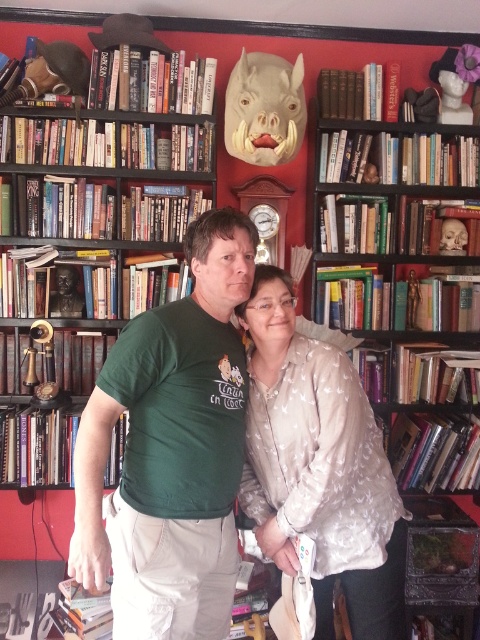
Does wooden bookshelf at left appear on the left side of hardcover books at right?

Yes, wooden bookshelf at left is to the left of hardcover books at right.

How distant is wooden bookshelf at left from hardcover books at right?

wooden bookshelf at left and hardcover books at right are 34.61 inches apart from each other.

Does point (120, 193) come farther from viewer compared to point (389, 406)?

No, (120, 193) is closer to viewer.

Identify the location of wooden bookshelf at left. The height and width of the screenshot is (640, 480). (94, 232).

Between green cotton shirt at center and hardcover books at right, which one appears on the left side from the viewer's perspective?

green cotton shirt at center is more to the left.

Image resolution: width=480 pixels, height=640 pixels. What do you see at coordinates (171, 449) in the screenshot?
I see `green cotton shirt at center` at bounding box center [171, 449].

This screenshot has height=640, width=480. In order to click on green cotton shirt at center in this screenshot , I will do `click(171, 449)`.

Does wooden bookshelf at left have a lesser width compared to silky beige blouse at center?

Incorrect, wooden bookshelf at left's width is not less than silky beige blouse at center's.

Can you confirm if wooden bookshelf at left is taller than silky beige blouse at center?

Yes, wooden bookshelf at left is taller than silky beige blouse at center.

Between point (154, 298) and point (340, 483), which one is positioned behind?

Point (154, 298)

At what (x,y) coordinates should I click in order to perform the action: click on wooden bookshelf at left. Please return your answer as a coordinate pair (x, y). Looking at the image, I should click on (94, 232).